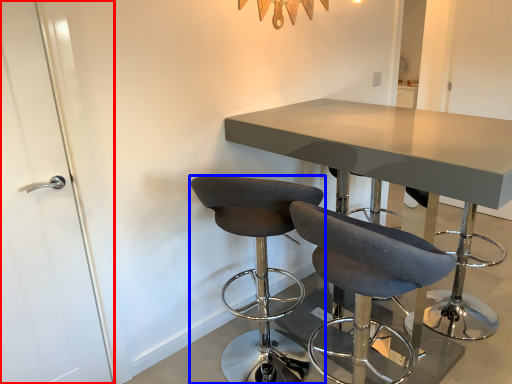
Question: Which point is further to the camera, door (highlighted by a red box) or chair (highlighted by a blue box)?

Choices:
 (A) door
 (B) chair

Answer: (B)